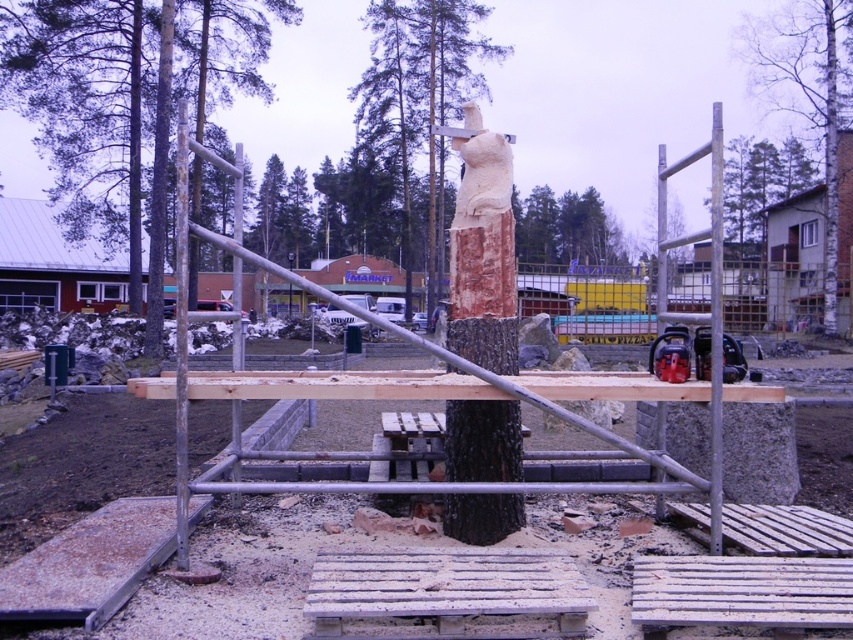
How distant is brown wood tree at center from smooth silver pole at right?

A distance of 65.73 feet exists between brown wood tree at center and smooth silver pole at right.

Does brown wood tree at center appear over smooth silver pole at right?

Correct, brown wood tree at center is located above smooth silver pole at right.

Is point (15, 13) farther from viewer compared to point (715, 376)?

Yes, it is.

The height and width of the screenshot is (640, 853). I want to click on brown wood tree at center, so click(x=125, y=97).

Does brown wood tree at center appear on the right side of bark at center?

No, brown wood tree at center is not to the right of bark at center.

Between point (158, 189) and point (799, 1), which one is positioned in front?

Point (158, 189)

You are a GUI agent. You are given a task and a screenshot of the screen. Output one action in this format:
    pyautogui.click(x=<x>, y=<y>)
    Task: Click on the brown wood tree at center
    This screenshot has width=853, height=640.
    Given the screenshot: What is the action you would take?
    pyautogui.click(x=125, y=97)

From the picture: Which is below, bark at center or smooth silver pole at right?

Positioned lower is smooth silver pole at right.

Based on the photo, can you confirm if bark at center is positioned above smooth silver pole at right?

Correct, bark at center is located above smooth silver pole at right.

This screenshot has width=853, height=640. What are the coordinates of `bark at center` in the screenshot? It's located at (808, 92).